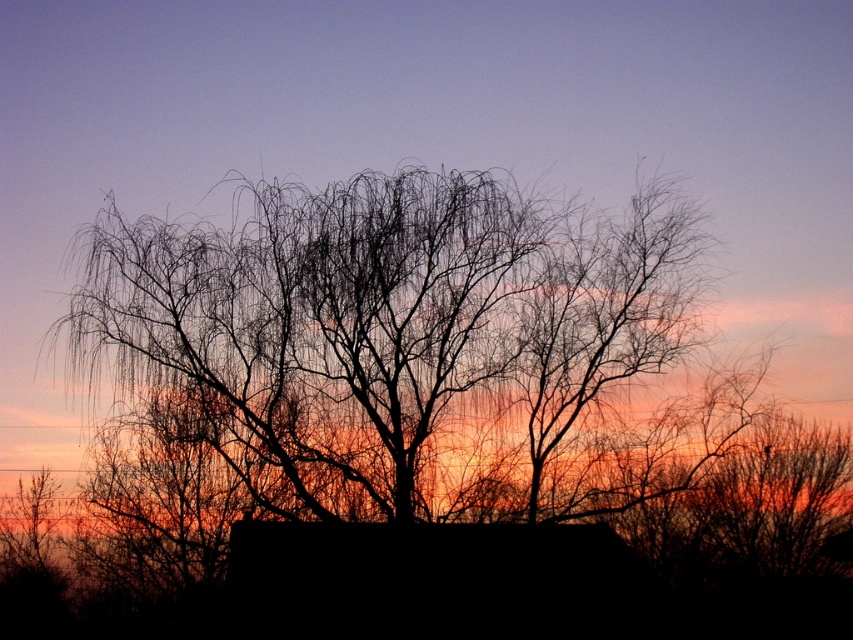
Question: Which object appears farthest from the camera in this image?

Choices:
 (A) black matte hut at center
 (B) silhouette branches at center

Answer: (B)

Question: Where is silhouette branches at center located in relation to black matte hut at center in the image?

Choices:
 (A) left
 (B) right

Answer: (A)

Question: Which of the following is the closest to the observer?

Choices:
 (A) (648, 468)
 (B) (315, 566)

Answer: (B)

Question: Which object appears farthest from the camera in this image?

Choices:
 (A) silhouette branches at center
 (B) black matte hut at center

Answer: (A)

Question: From the image, what is the correct spatial relationship of silhouette branches at center in relation to black matte hut at center?

Choices:
 (A) below
 (B) above

Answer: (B)

Question: Is silhouette branches at center to the right of black matte hut at center from the viewer's perspective?

Choices:
 (A) no
 (B) yes

Answer: (A)